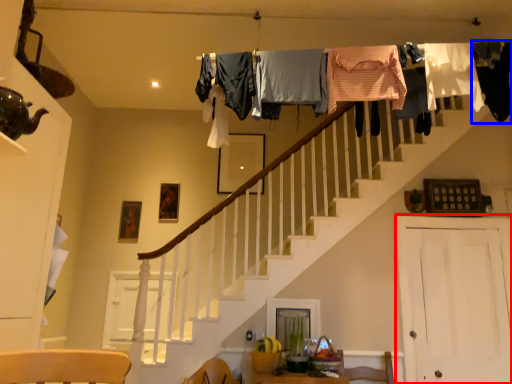
Question: Which object is further to the camera taking this photo, barn door (highlighted by a red box) or clothing (highlighted by a blue box)?

Choices:
 (A) barn door
 (B) clothing

Answer: (A)